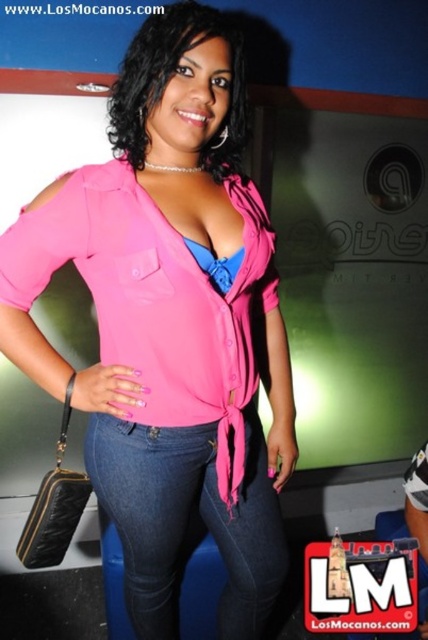
Looking at this image, can you confirm if pink matte shirt at center is bigger than denim jeans at center?

Yes.

Who is positioned more to the right, pink matte shirt at center or denim jeans at center?

Positioned to the right is denim jeans at center.

The height and width of the screenshot is (640, 428). I want to click on pink matte shirt at center, so click(x=171, y=323).

Locate an element on the screen. The image size is (428, 640). pink matte shirt at center is located at coordinates (171, 323).